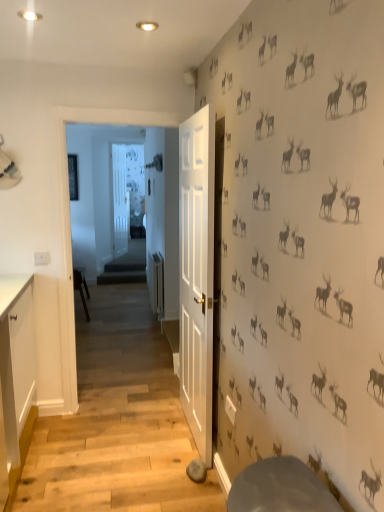
What do you see at coordinates (119, 200) in the screenshot? The width and height of the screenshot is (384, 512). I see `white wooden door at center` at bounding box center [119, 200].

At what (x,y) coordinates should I click in order to perform the action: click on white wooden door at center. Please return your answer as a coordinate pair (x, y). This screenshot has height=512, width=384. Looking at the image, I should click on (119, 200).

Measure the distance between point (118, 179) and camera.

A distance of 7.56 meters exists between point (118, 179) and camera.

What is the approximate width of white glossy cabinet at left?

20.34 inches.

What do you see at coordinates (15, 378) in the screenshot? The image size is (384, 512). I see `white glossy cabinet at left` at bounding box center [15, 378].

The height and width of the screenshot is (512, 384). In order to click on white glossy cabinet at left in this screenshot , I will do `click(15, 378)`.

From the picture: What is the approximate height of white glossy cabinet at left?

35.07 inches.

Image resolution: width=384 pixels, height=512 pixels. I want to click on white wooden door at center, so click(x=119, y=200).

Considering the positions of objects white glossy cabinet at left and white wooden door at center in the image provided, who is more to the left, white glossy cabinet at left or white wooden door at center?

Positioned to the left is white wooden door at center.

Consider the image. Considering the relative positions of white glossy cabinet at left and white wooden door at center in the image provided, is white glossy cabinet at left behind white wooden door at center?

No, white glossy cabinet at left is closer to the camera.

Is point (14, 318) closer or farther from the camera than point (118, 252)?

Point (14, 318) is closer to the camera than point (118, 252).

From the image's perspective, is white glossy cabinet at left above or below white wooden door at center?

From the image's perspective, white glossy cabinet at left appears below white wooden door at center.

Based on the photo, from a real-world perspective, does white glossy cabinet at left stand above white wooden door at center?

Incorrect, from a real-world perspective, white glossy cabinet at left is lower than white wooden door at center.

Considering the sizes of objects white glossy cabinet at left and white wooden door at center in the image provided, who is wider, white glossy cabinet at left or white wooden door at center?

With larger width is white glossy cabinet at left.

Does white glossy cabinet at left have a lesser height compared to white wooden door at center?

Yes.

Is white glossy cabinet at left smaller than white wooden door at center?

No.

Is white wooden door at center completely or partially inside white glossy cabinet at left?

No.

Based on the photo, is white glossy cabinet at left far away from white wooden door at center?

That's right, there is a large distance between white glossy cabinet at left and white wooden door at center.

Is white glossy cabinet at left aimed at white wooden door at center?

No.

What's the angular difference between white glossy cabinet at left and white wooden door at center's facing directions?

The facing directions of white glossy cabinet at left and white wooden door at center are 111 degrees apart.

Where is `cabinetry below the white wooden door at center (from the image's perspective)`? Image resolution: width=384 pixels, height=512 pixels. cabinetry below the white wooden door at center (from the image's perspective) is located at coordinates (15, 378).

From the picture: Is white wooden door at center to the right of white glossy cabinet at left from the viewer's perspective?

In fact, white wooden door at center is to the left of white glossy cabinet at left.

Does white wooden door at center lie behind white glossy cabinet at left?

Yes, the depth of white wooden door at center is greater than that of white glossy cabinet at left.

Which is more distant, (116, 222) or (10, 462)?

The point (116, 222) is more distant.

From the image's perspective, is white wooden door at center located above or below white glossy cabinet at left?

Based on their image positions, white wooden door at center is located above white glossy cabinet at left.

From a real-world perspective, between white wooden door at center and white glossy cabinet at left, who is vertically lower?

white glossy cabinet at left, from a real-world perspective.

Which of these two, white wooden door at center or white glossy cabinet at left, is wider?

Wider between the two is white glossy cabinet at left.

Considering the relative sizes of white wooden door at center and white glossy cabinet at left in the image provided, is white wooden door at center shorter than white glossy cabinet at left?

No, white wooden door at center is not shorter than white glossy cabinet at left.

Is white wooden door at center bigger or smaller than white glossy cabinet at left?

In the image, white wooden door at center appears to be smaller than white glossy cabinet at left.

Is white glossy cabinet at left surrounded by white wooden door at center?

That's incorrect, white glossy cabinet at left is not inside white wooden door at center.

Is white wooden door at center next to white glossy cabinet at left and touching it?

white wooden door at center and white glossy cabinet at left are clearly separated.

Is white wooden door at center looking in the opposite direction of white glossy cabinet at left?

No, white wooden door at center is not facing away from white glossy cabinet at left.

How many degrees apart are the facing directions of white wooden door at center and white glossy cabinet at left?

The angle between the facing direction of white wooden door at center and the facing direction of white glossy cabinet at left is 111 degrees.

Where is `cabinetry below the white wooden door at center (from a real-world perspective)`? The height and width of the screenshot is (512, 384). cabinetry below the white wooden door at center (from a real-world perspective) is located at coordinates (15, 378).

Find the location of a particular element. The height and width of the screenshot is (512, 384). cabinetry on the right of white wooden door at center is located at coordinates (15, 378).

I want to click on door behind the white glossy cabinet at left, so click(119, 200).